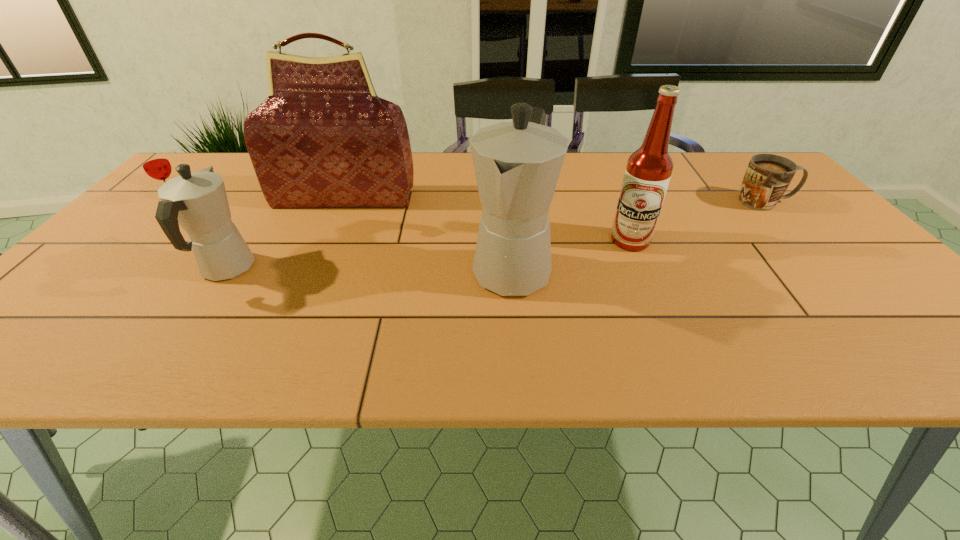
Locate an element on the screen. The height and width of the screenshot is (540, 960). free space located 0.350m on the back of the shorter coffeepot is located at coordinates (290, 174).

This screenshot has height=540, width=960. Identify the location of vacant position located 0.230m on the right of the fourth object from left to right. (653, 268).

Where is `vacant space located 0.100m on the right of the second shortest object`? vacant space located 0.100m on the right of the second shortest object is located at coordinates (224, 204).

Where is `vacant point located on the label side of the fifth object from left to right`? The height and width of the screenshot is (540, 960). vacant point located on the label side of the fifth object from left to right is located at coordinates click(664, 321).

At what (x,y) coordinates should I click in order to perform the action: click on free space located on the front-facing side of the handbag. Please return your answer as a coordinate pair (x, y). Looking at the image, I should click on (335, 220).

You are a GUI agent. You are given a task and a screenshot of the screen. Output one action in this format:
    pyautogui.click(x=<x>, y=<y>)
    Task: Click on the object that is at the far edge
    The image size is (960, 540).
    Given the screenshot: What is the action you would take?
    pyautogui.click(x=323, y=138)

Find the location of a particular element. This screenshot has height=540, width=960. object located at the left edge is located at coordinates (155, 163).

Find the location of a particular element. The image size is (960, 540). object located in the right edge section of the desktop is located at coordinates (767, 177).

The height and width of the screenshot is (540, 960). In order to click on vacant space at the far edge of the desktop in this screenshot , I will do `click(722, 178)`.

This screenshot has height=540, width=960. What are the coordinates of `vacant area at the near edge of the desktop` in the screenshot? It's located at (781, 318).